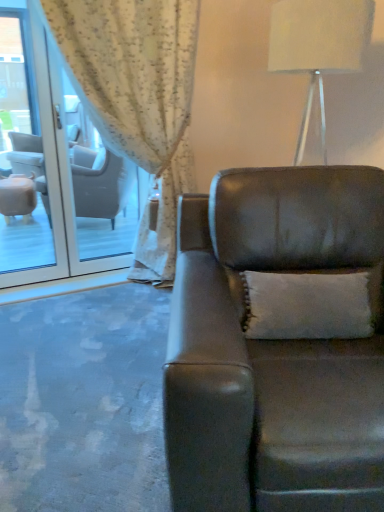
Question: Does white textured pillow at center contain leather couch at center?

Choices:
 (A) no
 (B) yes

Answer: (A)

Question: From a real-world perspective, is white textured pillow at center beneath leather couch at center?

Choices:
 (A) yes
 (B) no

Answer: (B)

Question: Is white textured pillow at center beside leather couch at center?

Choices:
 (A) yes
 (B) no

Answer: (B)

Question: Can you confirm if white textured pillow at center is positioned to the left of leather couch at center?

Choices:
 (A) no
 (B) yes

Answer: (B)

Question: Is white textured pillow at center wider than leather couch at center?

Choices:
 (A) no
 (B) yes

Answer: (A)

Question: Considering the relative sizes of white textured pillow at center and leather couch at center in the image provided, is white textured pillow at center taller than leather couch at center?

Choices:
 (A) yes
 (B) no

Answer: (B)

Question: Does white textured curtain at upper left have a lesser width compared to white textured pillow at center?

Choices:
 (A) yes
 (B) no

Answer: (B)

Question: Considering the relative positions of white textured curtain at upper left and white textured pillow at center in the image provided, is white textured curtain at upper left to the right of white textured pillow at center from the viewer's perspective?

Choices:
 (A) no
 (B) yes

Answer: (A)

Question: Would you consider white textured curtain at upper left to be distant from white textured pillow at center?

Choices:
 (A) no
 (B) yes

Answer: (B)

Question: Is white textured curtain at upper left not within white textured pillow at center?

Choices:
 (A) no
 (B) yes

Answer: (B)

Question: From the image's perspective, does white textured curtain at upper left appear lower than white textured pillow at center?

Choices:
 (A) no
 (B) yes

Answer: (A)

Question: From a real-world perspective, is white textured curtain at upper left physically above white textured pillow at center?

Choices:
 (A) no
 (B) yes

Answer: (B)

Question: From a real-world perspective, is white textured curtain at upper left on top of clear glass door at left?

Choices:
 (A) no
 (B) yes

Answer: (B)